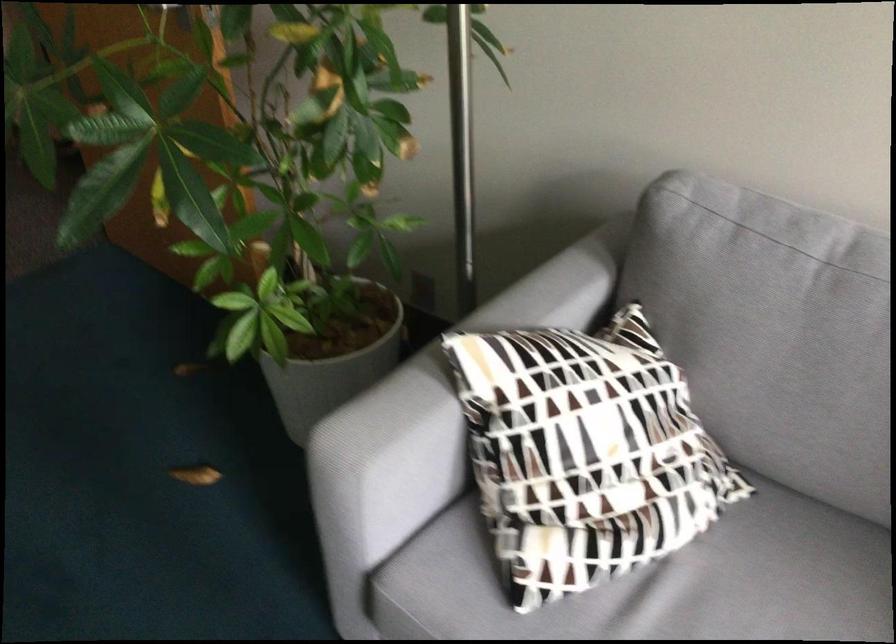
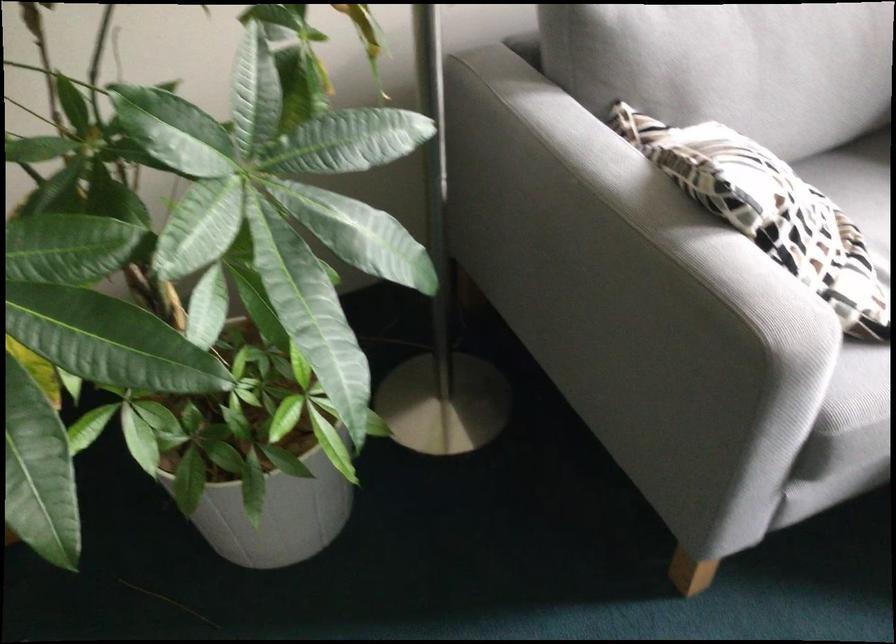
In the second image, find the point that corresponds to (498,386) in the first image.

(768, 212)